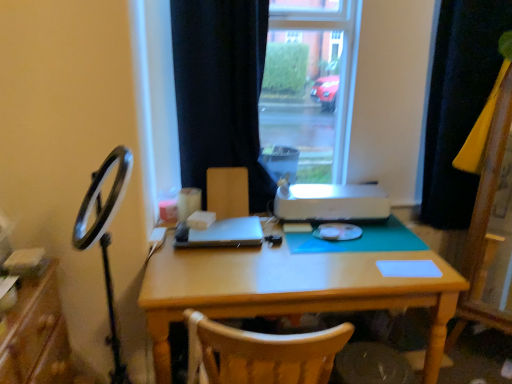
The height and width of the screenshot is (384, 512). In order to click on unoccupied space behind white matte notepad at center in this screenshot , I will do `click(396, 249)`.